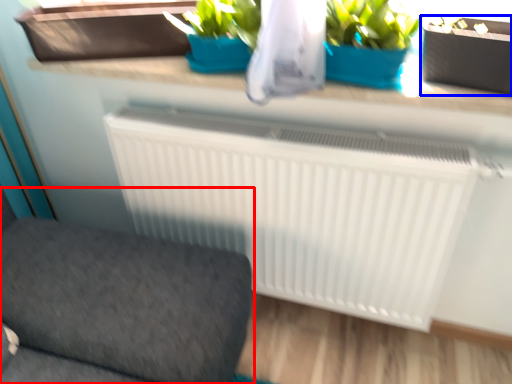
Question: Which of the following is the closest to the observer, furniture (highlighted by a red box) or flowerpot (highlighted by a blue box)?

Choices:
 (A) furniture
 (B) flowerpot

Answer: (A)